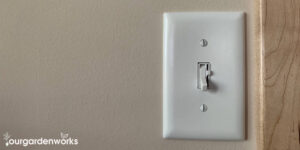
Locate an element on the screen. Image resolution: width=300 pixels, height=150 pixels. wood border is located at coordinates (286, 58).